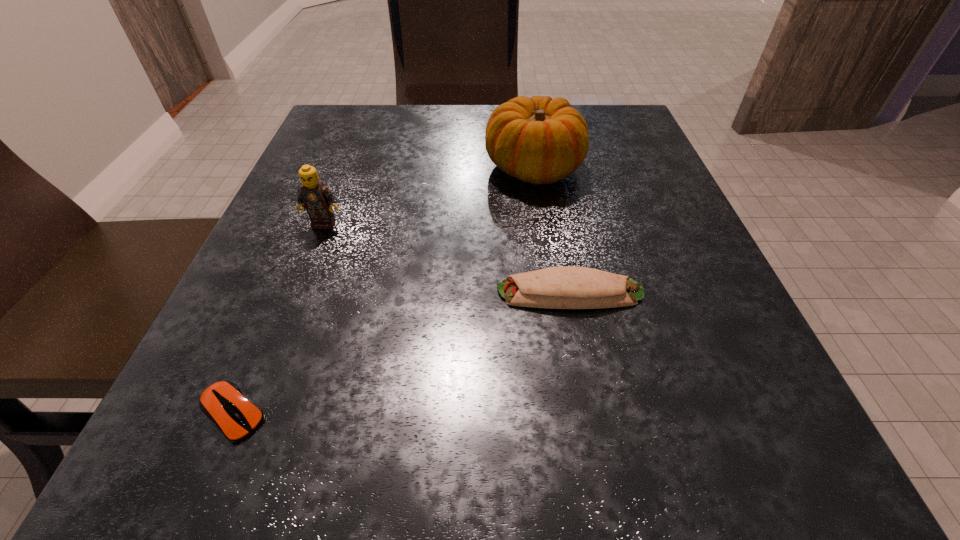
Where is `vacant region located 0.340m at the bitten end of the third farthest object`? The height and width of the screenshot is (540, 960). vacant region located 0.340m at the bitten end of the third farthest object is located at coordinates (261, 293).

This screenshot has height=540, width=960. In order to click on vacant region located 0.250m on the right of the computer mouse in this screenshot , I will do `click(485, 414)`.

Where is `object present at the far edge`? object present at the far edge is located at coordinates (539, 140).

Where is `object present at the near edge`? object present at the near edge is located at coordinates (224, 403).

You are a GUI agent. You are given a task and a screenshot of the screen. Output one action in this format:
    pyautogui.click(x=<x>, y=<y>)
    Task: Click on the Lego that is at the left edge
    The height and width of the screenshot is (540, 960).
    Given the screenshot: What is the action you would take?
    pyautogui.click(x=315, y=197)

At what (x,y) coordinates should I click in order to perform the action: click on computer mouse that is at the left edge. Please return your answer as a coordinate pair (x, y). The width and height of the screenshot is (960, 540). Looking at the image, I should click on (224, 403).

This screenshot has width=960, height=540. I want to click on gourd present at the right edge, so point(539,140).

Find the location of a particular element. This screenshot has width=960, height=540. burrito that is at the right edge is located at coordinates (567, 287).

This screenshot has width=960, height=540. Identify the location of object present at the near left corner. (224, 403).

Where is `object that is at the far right corner`? object that is at the far right corner is located at coordinates (539, 140).